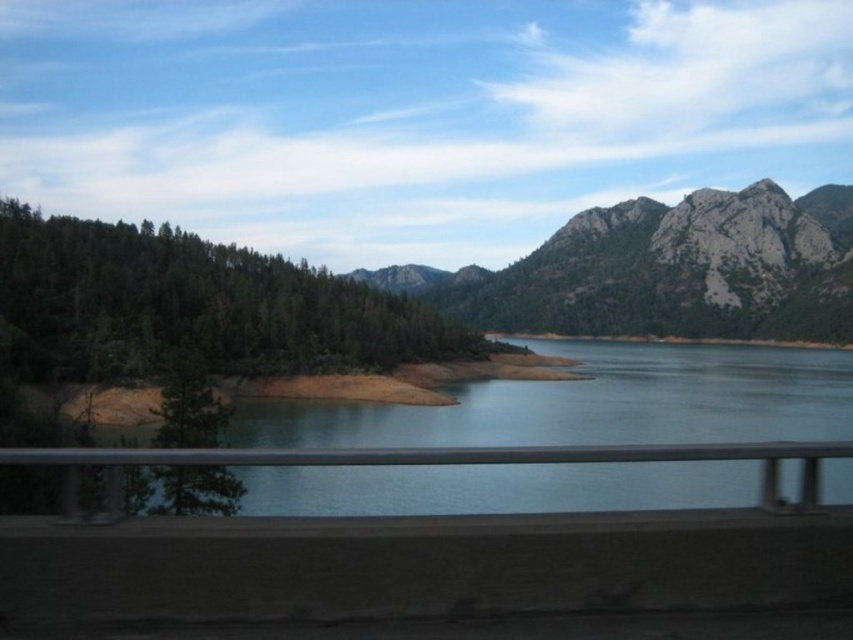
You are a photographer standing at the scene described. You want to capture a photo that includes the gray rocky mountain at upper right. Considering the distance, what is the minimum focal length lens you should use if you want the mountain to occupy at least 30 percent of the frame height?

The gray rocky mountain at upper right is 198.31 meters away. To determine the minimum focal length needed, use the formula focal length required equals object distance multiplied by desired height over sensor height. Assuming a full frame sensor with a height of 24mm and the mountain needing to occupy 30 percent of the frame height, the calculation would be 198.31 meters times 0.3 times 24mm divided by the sensor height. However, without specific sensor dimensions or mountain height, an exact value can not

You are a hiker planning to take a photo from the guardrail mentioned in the scene. You want to frame the gray rocky mountain at upper right and the green matte tree at lower left in your shot. Which object should you position at the top of your camera frame?

The gray rocky mountain at upper right should be positioned at the top of the camera frame because it is above the green matte tree at lower left.

You are a hiker trying to determine the best path to the water. You see the green matte forest at left and the green matte tree at lower left. Which one is closer to the water?

The green matte tree at lower left is closer to the water than the green matte forest at left.